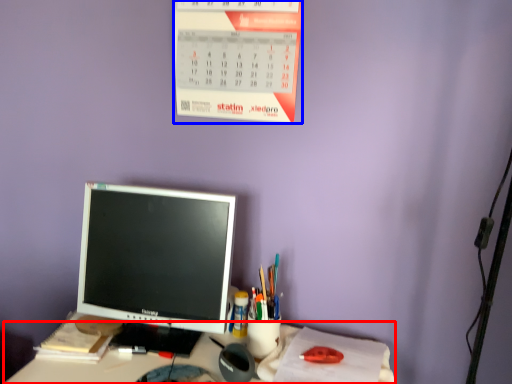
Question: Which point is further to the camera, desk (highlighted by a red box) or calendar (highlighted by a blue box)?

Choices:
 (A) desk
 (B) calendar

Answer: (B)